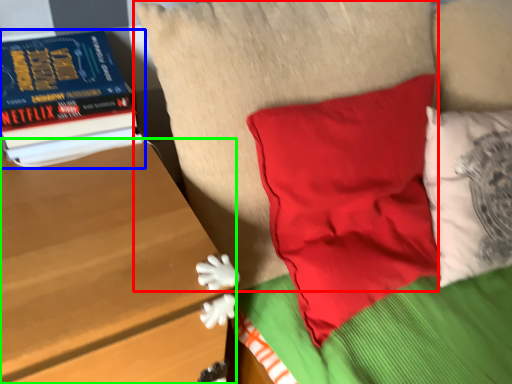
Question: Based on their relative distances, which object is farther from pillow (highlighted by a red box)? Choose from book (highlighted by a blue box) and table (highlighted by a green box).

Choices:
 (A) book
 (B) table

Answer: (B)